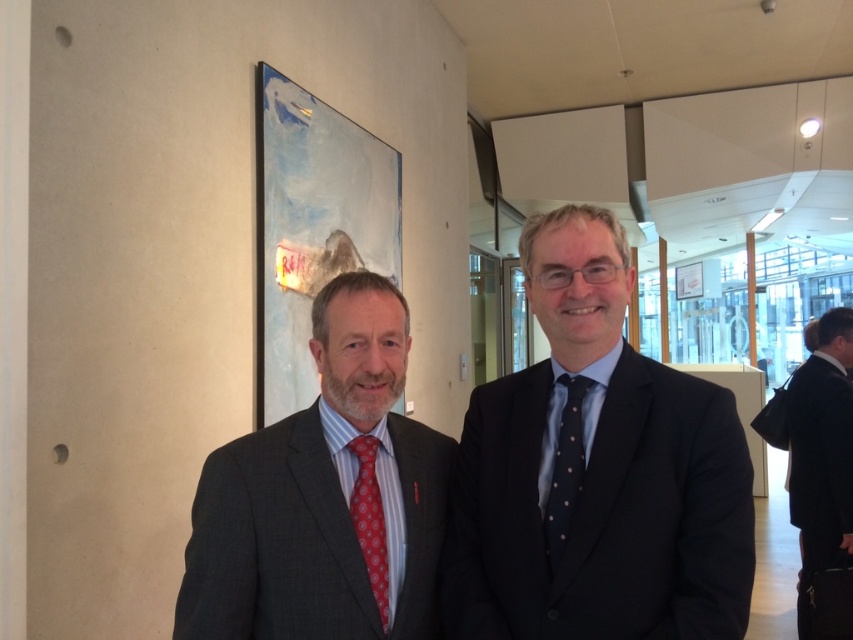
Question: Among these objects, which one is nearest to the camera?

Choices:
 (A) matte black suit at left
 (B) black suit at right

Answer: (A)

Question: Which of the following is the closest to the observer?

Choices:
 (A) (315, 602)
 (B) (596, 460)
 (C) (842, 522)

Answer: (A)

Question: Does matte black suit at left have a larger size compared to red dotted fabric tie at left?

Choices:
 (A) no
 (B) yes

Answer: (B)

Question: Is matte black suit at left below red dotted fabric tie at left?

Choices:
 (A) no
 (B) yes

Answer: (A)

Question: Among these objects, which one is farthest from the camera?

Choices:
 (A) black suit at right
 (B) blue dotted fabric tie at center

Answer: (A)

Question: Can you confirm if matte black suit at left is smaller than black suit at right?

Choices:
 (A) yes
 (B) no

Answer: (A)